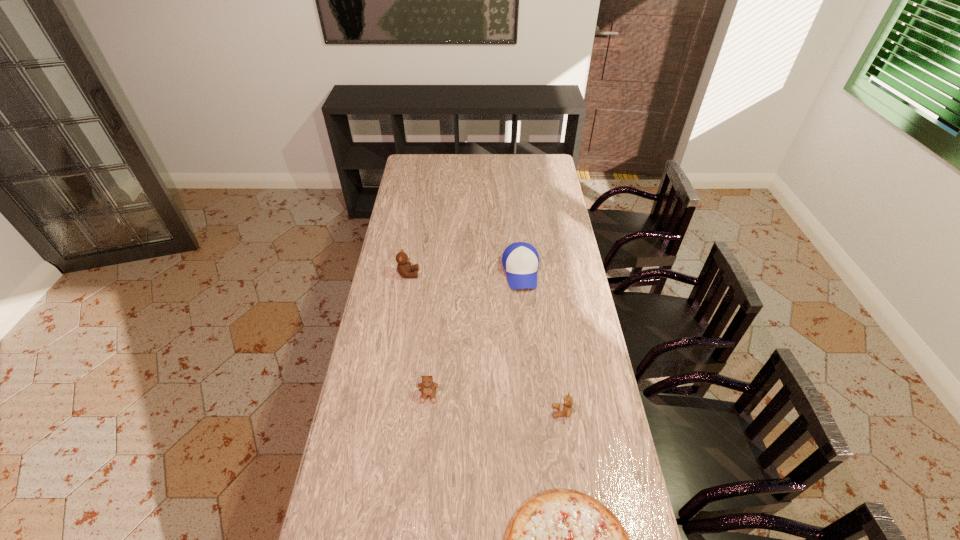
Locate an element on the screen. Image resolution: width=960 pixels, height=540 pixels. vacant area located on the front-facing side of the rightmost teddy bear is located at coordinates (475, 411).

Where is `object located in the left edge section of the desktop`? The width and height of the screenshot is (960, 540). object located in the left edge section of the desktop is located at coordinates (404, 268).

Locate an element on the screen. object that is at the right edge is located at coordinates (565, 407).

Locate an element on the screen. This screenshot has width=960, height=540. vacant position at the far edge of the desktop is located at coordinates (482, 161).

This screenshot has height=540, width=960. Identify the location of vacant region at the left edge of the desktop. (360, 372).

Locate an element on the screen. free space at the right edge is located at coordinates (583, 291).

This screenshot has width=960, height=540. What are the coordinates of `vacant area that lies between the leftmost teddy bear and the baseball cap` in the screenshot? It's located at (465, 273).

You are a GUI agent. You are given a task and a screenshot of the screen. Output one action in this format:
    pyautogui.click(x=<x>, y=<y>)
    Task: Click on the unoccupied area between the farthest teddy bear and the fourth object from right to left
    
    Given the screenshot: What is the action you would take?
    pyautogui.click(x=419, y=335)

What are the coordinates of `the second closest object to the farthest teddy bear` in the screenshot? It's located at 428,388.

The image size is (960, 540). What are the coordinates of `object that is the second closest to the pizza` in the screenshot? It's located at (428, 388).